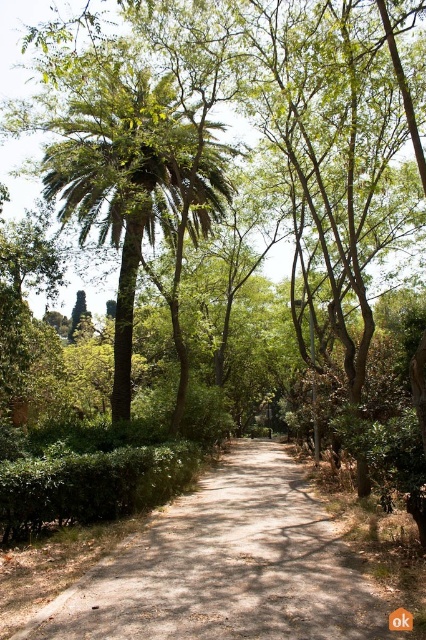
Question: Among these points, which one is nearest to the camera?

Choices:
 (A) (37, 630)
 (B) (101, 163)

Answer: (A)

Question: Does dirt path at center have a greater width compared to green leafy palm tree at upper left?

Choices:
 (A) no
 (B) yes

Answer: (A)

Question: Can you confirm if dirt path at center is smaller than green leafy palm tree at upper left?

Choices:
 (A) no
 (B) yes

Answer: (B)

Question: Which object appears closest to the camera in this image?

Choices:
 (A) dirt path at center
 (B) green leafy palm tree at upper left

Answer: (A)

Question: Can you confirm if dirt path at center is smaller than green leafy palm tree at upper left?

Choices:
 (A) yes
 (B) no

Answer: (A)